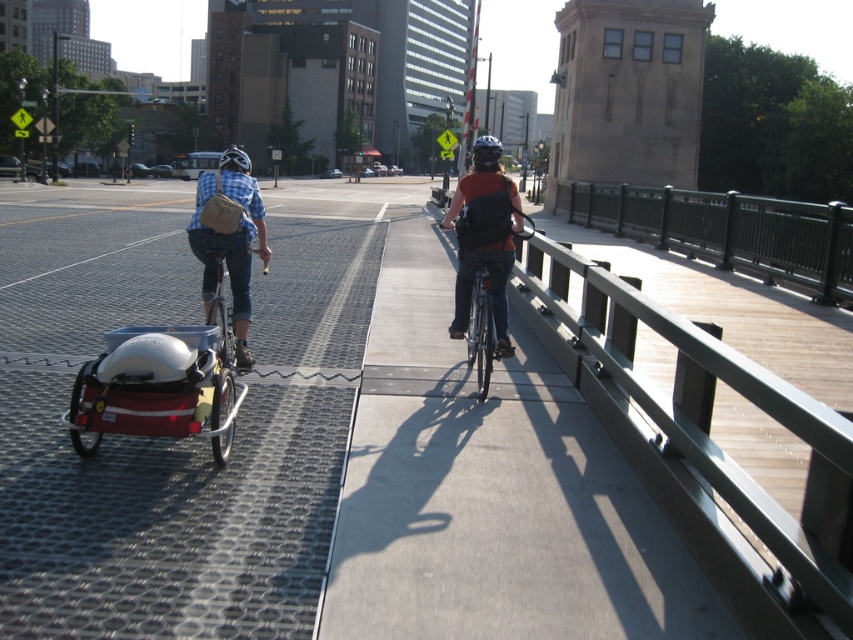
Question: Which point appears farthest from the camera in this image?

Choices:
 (A) [223, 160]
 (B) [514, 225]

Answer: (B)

Question: Considering the relative positions of blue plaid shirt at center and black matte helmet at center in the image provided, where is blue plaid shirt at center located with respect to black matte helmet at center?

Choices:
 (A) below
 (B) above

Answer: (A)

Question: Which of these objects is positioned farthest from the black matte helmet at center?

Choices:
 (A) blue plaid shirt at center
 (B) matte black bicycle at center

Answer: (A)

Question: Is matte black bicycle at center wider than black matte helmet at center?

Choices:
 (A) yes
 (B) no

Answer: (B)

Question: Can you confirm if blue plaid shirt at center is thinner than black matte helmet at center?

Choices:
 (A) yes
 (B) no

Answer: (A)

Question: Among these objects, which one is nearest to the camera?

Choices:
 (A) blue plaid shirt at center
 (B) matte black helmet at upper center
 (C) black matte helmet at center
 (D) matte black bicycle at center

Answer: (A)